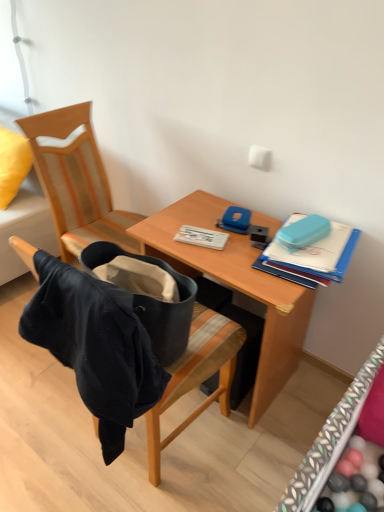
At what (x,y) coordinates should I click in order to perform the action: click on free spot in front of white plastic notebook at center. Please return your answer as a coordinate pair (x, y). Image resolution: width=384 pixels, height=512 pixels. Looking at the image, I should click on (221, 257).